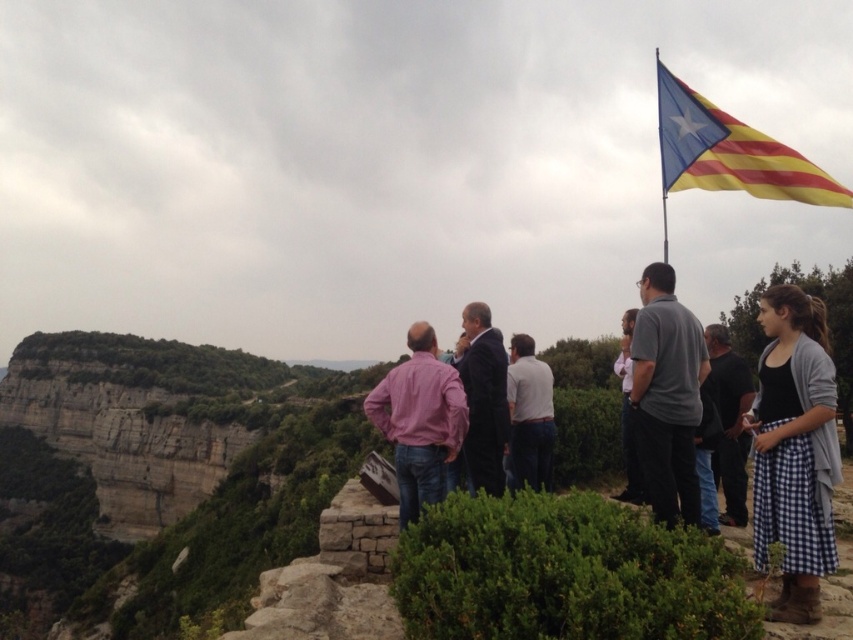
Question: Where is dark blue suit at center located in relation to white cotton shirt at center in the image?

Choices:
 (A) above
 (B) below

Answer: (A)

Question: Among these objects, which one is nearest to the camera?

Choices:
 (A) pink shirt at center
 (B) gray fabric shirt at center-right

Answer: (B)

Question: Can you confirm if yellow striped fabric at upper right is positioned above white cotton shirt at center?

Choices:
 (A) no
 (B) yes

Answer: (B)

Question: Is gray fabric shirt at center-right further to camera compared to dark blue suit at center?

Choices:
 (A) no
 (B) yes

Answer: (A)

Question: Which point is closer to the camera?

Choices:
 (A) (763, 310)
 (B) (368, 417)

Answer: (A)

Question: Which of the following is the closest to the observer?

Choices:
 (A) gray fabric shirt at right
 (B) dark blue suit at center
 (C) blue checkered skirt at right
 (D) yellow striped fabric at upper right

Answer: (C)